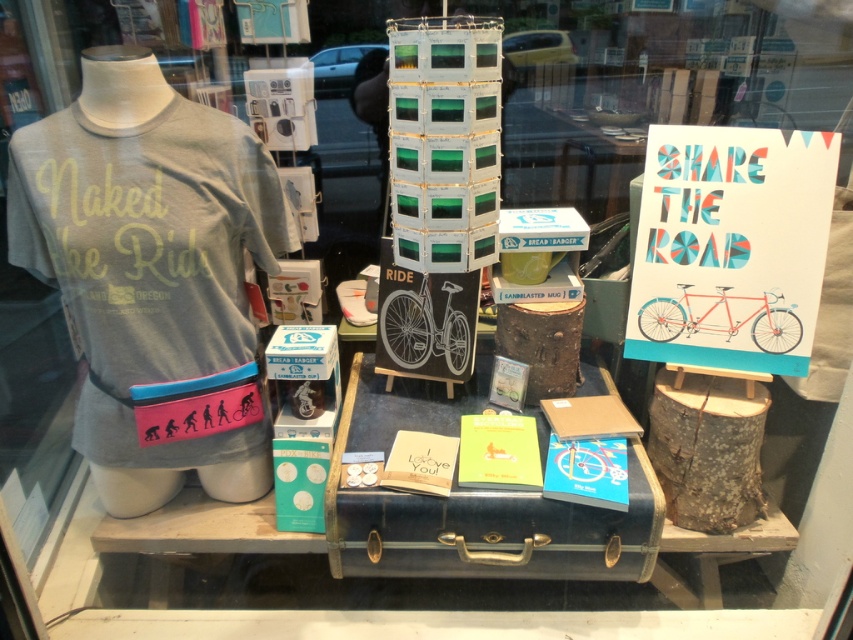
Can you confirm if gray cotton t-shirt at left is positioned to the left of vintage leather suitcase at center?

Yes, gray cotton t-shirt at left is to the left of vintage leather suitcase at center.

Is point (247, 458) more distant than point (610, 554)?

Yes, point (247, 458) is behind point (610, 554).

Describe the element at coordinates (146, 244) in the screenshot. I see `gray cotton t-shirt at left` at that location.

Where is `gray cotton t-shirt at left`? The width and height of the screenshot is (853, 640). gray cotton t-shirt at left is located at coordinates (146, 244).

Does gray cotton t-shirt at left lie in front of white paper sign at upper right?

Yes, gray cotton t-shirt at left is in front of white paper sign at upper right.

Who is more forward, (196, 205) or (785, 145)?

Point (196, 205)

Identify the location of gray cotton t-shirt at left. The height and width of the screenshot is (640, 853). (146, 244).

Can you confirm if white paper sign at upper right is positioned to the left of vintage leather suitcase at center?

In fact, white paper sign at upper right is to the right of vintage leather suitcase at center.

You are a GUI agent. You are given a task and a screenshot of the screen. Output one action in this format:
    pyautogui.click(x=<x>, y=<y>)
    Task: Click on the white paper sign at upper right
    
    Given the screenshot: What is the action you would take?
    pyautogui.click(x=730, y=246)

Find the location of `white paper sign at upper right`. white paper sign at upper right is located at coordinates (730, 246).